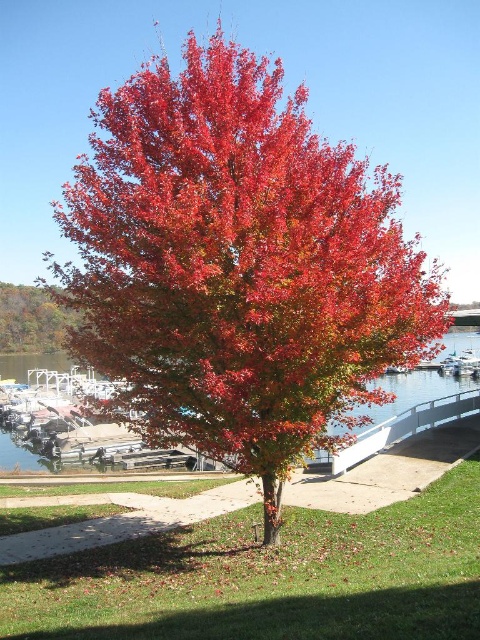
Is shiny red maple tree at center taller than clear water at center?

Indeed, shiny red maple tree at center has a greater height compared to clear water at center.

Is point (354, 316) less distant than point (471, 348)?

Yes, it is in front of point (471, 348).

At what (x,y) coordinates should I click in order to perform the action: click on shiny red maple tree at center. Please return your answer as a coordinate pair (x, y). This screenshot has width=480, height=640. Looking at the image, I should click on (238, 266).

The height and width of the screenshot is (640, 480). What do you see at coordinates (416, 390) in the screenshot?
I see `clear water at center` at bounding box center [416, 390].

In the scene shown: Between clear water at center and shiny brown tree at left, which one has less height?

With less height is clear water at center.

Who is more distant from viewer, (20,445) or (75,317)?

Point (75,317)

Image resolution: width=480 pixels, height=640 pixels. Identify the location of clear water at center. (416, 390).

Is shiny red maple tree at center behind shiny brown tree at left?

That is False.

Who is positioned more to the left, shiny red maple tree at center or shiny brown tree at left?

Positioned to the left is shiny brown tree at left.

Does point (256, 124) come in front of point (46, 348)?

Yes.

This screenshot has height=640, width=480. I want to click on shiny red maple tree at center, so click(238, 266).